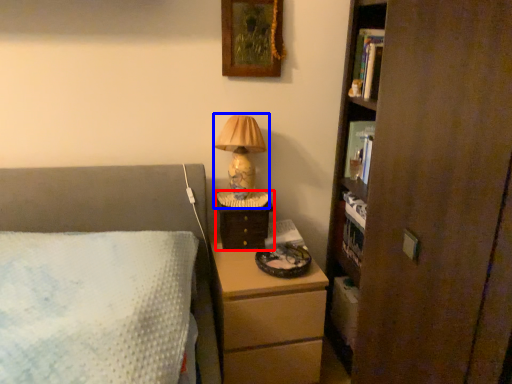
Question: Which point is closer to the camera, nightstand (highlighted by a red box) or table lamp (highlighted by a blue box)?

Choices:
 (A) nightstand
 (B) table lamp

Answer: (B)